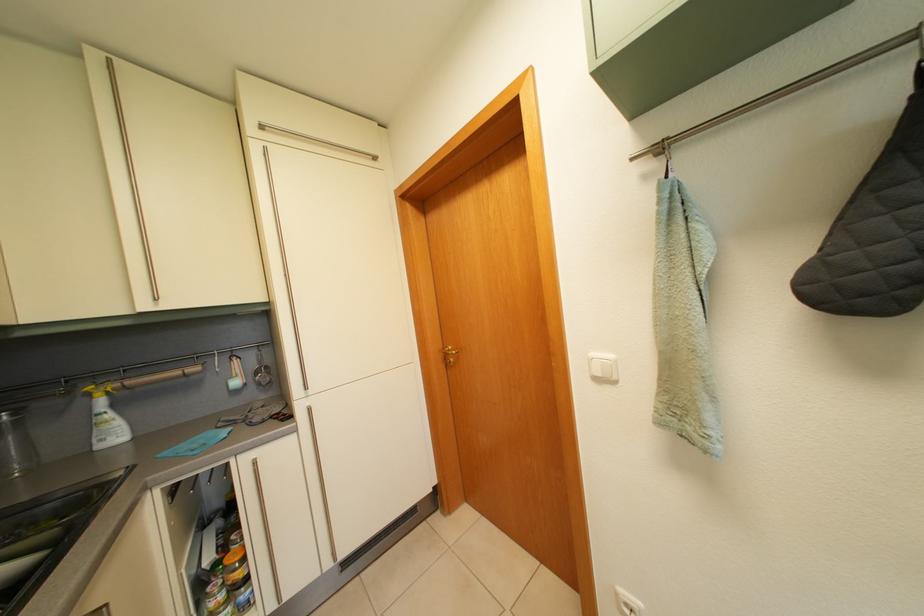
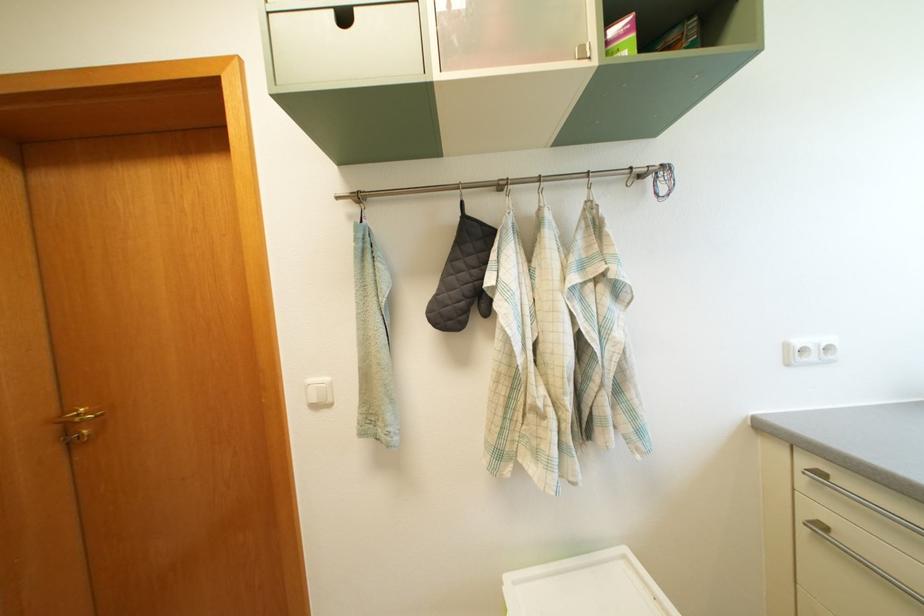
Find the pixel in the second image that matches pixel 647 155 in the first image.

(350, 197)